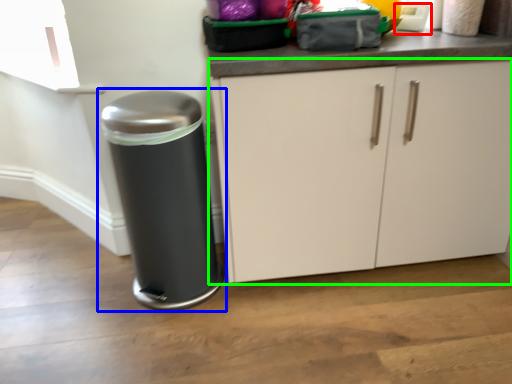
Question: Which object is positioned closest to appliance (highlighted by a red box)? Select from waste container (highlighted by a blue box) and cabinetry (highlighted by a green box).

Choices:
 (A) waste container
 (B) cabinetry

Answer: (B)